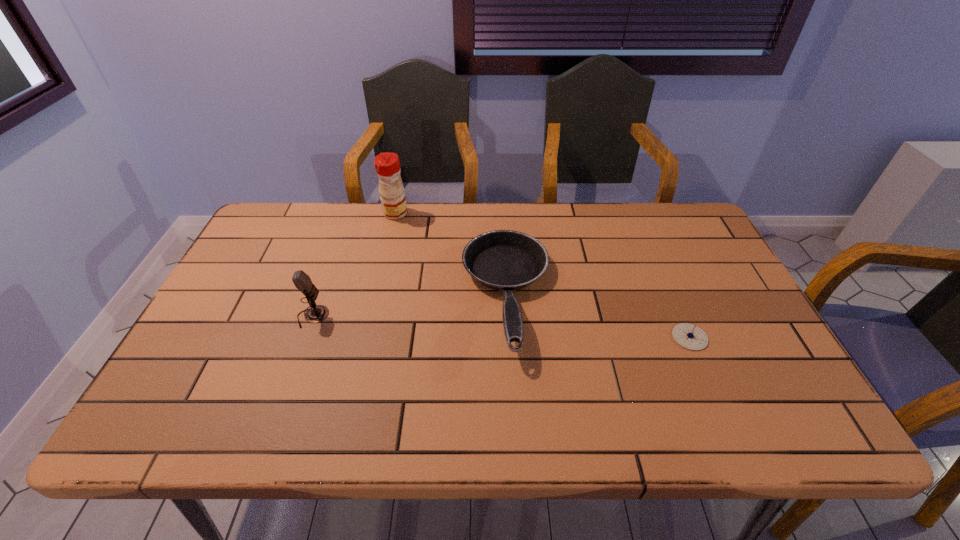
Find the location of a particular element. The height and width of the screenshot is (540, 960). the second closest object to the second shortest object is located at coordinates (689, 336).

The image size is (960, 540). In order to click on the closest object relative to the frying pan in this screenshot , I will do `click(387, 165)`.

Image resolution: width=960 pixels, height=540 pixels. What are the coordinates of `vacant region that satisfies the following two spatial constraints: 1. on the front-facing side of the second tallest object; 2. on the left side of the rightmost object` in the screenshot? It's located at (305, 337).

You are a GUI agent. You are given a task and a screenshot of the screen. Output one action in this format:
    pyautogui.click(x=<x>, y=<y>)
    Task: Click on the free point that satisfies the following two spatial constraints: 1. on the front side of the shortest object; 2. on the right side of the second object from right to left
    
    Given the screenshot: What is the action you would take?
    [509, 337]